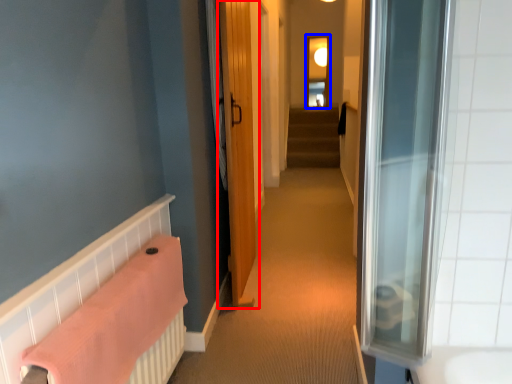
Question: Which object appears closest to the camera in this image, door (highlighted by a red box) or window (highlighted by a blue box)?

Choices:
 (A) door
 (B) window

Answer: (A)